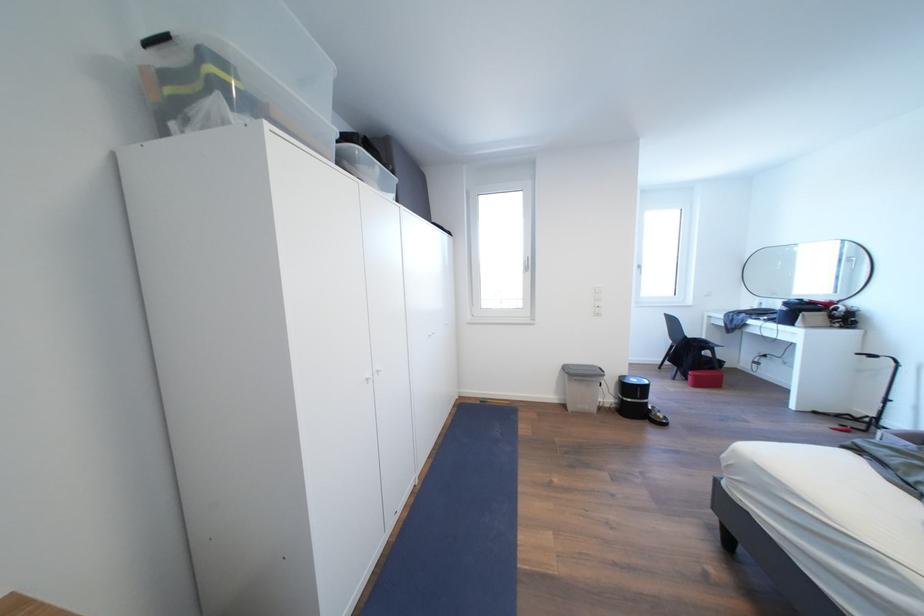
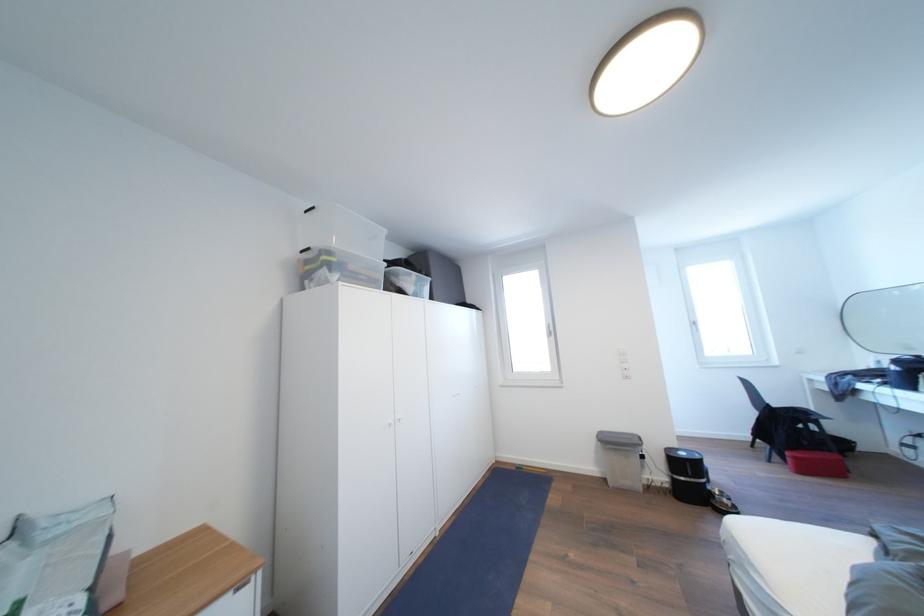
Find the pixel in the second image that matches pixel 641 386 in the first image.

(689, 459)